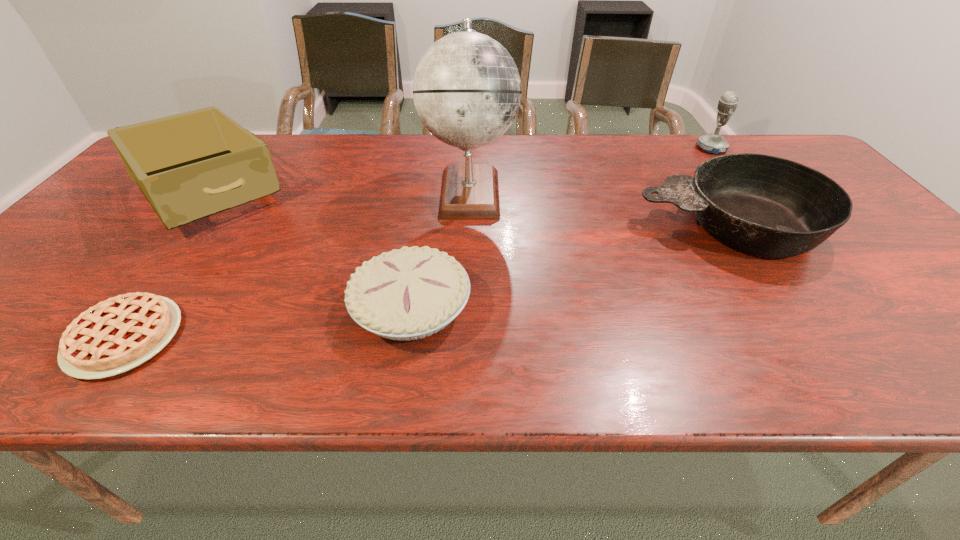
Find the location of `box that is at the far edge`. box that is at the far edge is located at coordinates (189, 166).

Identify the location of object situated at the left edge. (189, 166).

Find the location of `object that is at the right edge`. object that is at the right edge is located at coordinates (766, 206).

This screenshot has width=960, height=540. Identify the location of object located at the far left corner. (189, 166).

At what (x,y) coordinates should I click in order to perform the action: click on free spot at the far edge of the desktop. Please return your answer as a coordinate pair (x, y). The image size is (960, 540). Looking at the image, I should click on (525, 161).

The image size is (960, 540). What are the coordinates of `free region at the near edge` in the screenshot? It's located at (628, 359).

At what (x,y) coordinates should I click in order to perform the action: click on free space at the left edge. Please return your answer as a coordinate pair (x, y). This screenshot has width=960, height=540. Looking at the image, I should click on (121, 190).

In order to click on vacant space at the far right corner of the desktop in this screenshot , I will do pos(779,151).

The width and height of the screenshot is (960, 540). I want to click on vacant space that's between the microphone and the shorter pie, so click(418, 242).

The width and height of the screenshot is (960, 540). I want to click on vacant point located between the box and the shorter pie, so click(x=166, y=264).